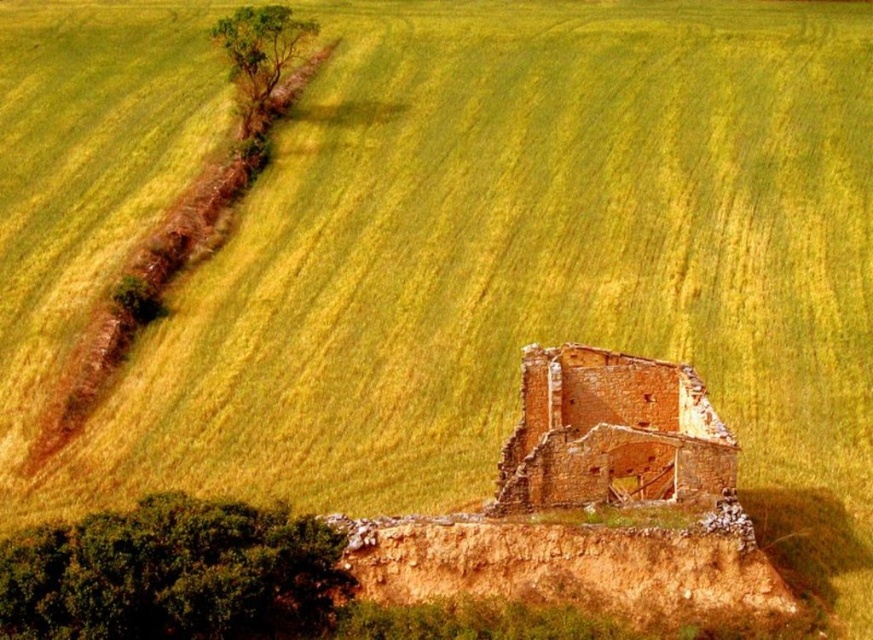
Question: Among these points, which one is nearest to the camera?

Choices:
 (A) (668, 470)
 (B) (253, 132)

Answer: (A)

Question: From the image, what is the correct spatial relationship of green leafy tree at lower left in relation to green leafy tree at upper left?

Choices:
 (A) left
 (B) right

Answer: (B)

Question: Is green leafy tree at lower left further to camera compared to green leafy tree at upper left?

Choices:
 (A) no
 (B) yes

Answer: (A)

Question: Which of the following is the closest to the observer?

Choices:
 (A) (607, 387)
 (B) (229, 20)

Answer: (A)

Question: Among these objects, which one is nearest to the camera?

Choices:
 (A) green leafy tree at upper left
 (B) green leafy tree at lower left
 (C) brick wall ruins at center

Answer: (B)

Question: Can you confirm if brick wall ruins at center is thinner than green leafy tree at upper left?

Choices:
 (A) yes
 (B) no

Answer: (A)